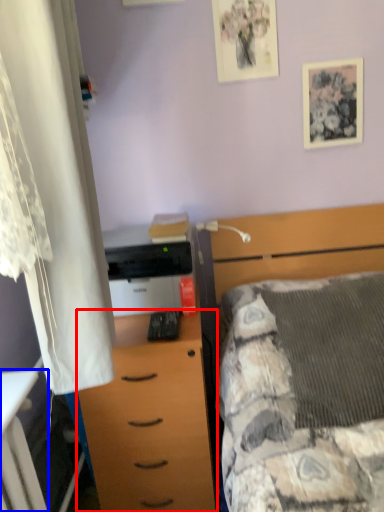
Question: Which object is further to the camera taking this photo, chest of drawers (highlighted by a red box) or desk (highlighted by a blue box)?

Choices:
 (A) chest of drawers
 (B) desk

Answer: (A)